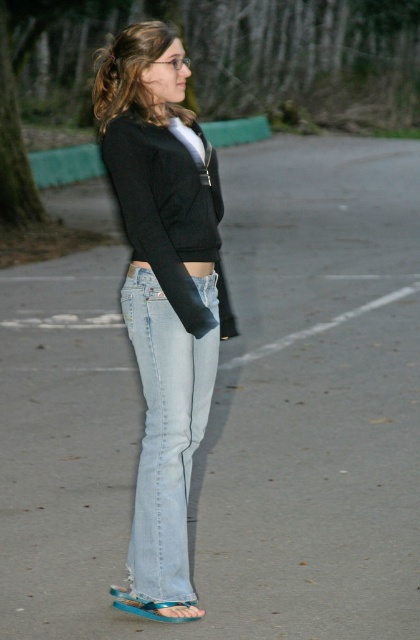
You are a fashion designer observing the woman in the scene. You need to determine which pair of jeans, the denim jeans at center or the light blue denim jeans at lower center, would be more suitable for a casual summer outfit. Based on their sizes, which one do you recommend?

The denim jeans at center is larger in size than the light blue denim jeans at lower center, so the denim jeans at center would be more suitable for a casual summer outfit if a larger size is preferred.

You are a fashion designer observing the woman in the image. You need to determine which item of clothing is taller between the denim jeans at center and the blue rubber sandal at lower center. Which one is taller?

The denim jeans at center is taller than the blue rubber sandal at lower center according to the description.